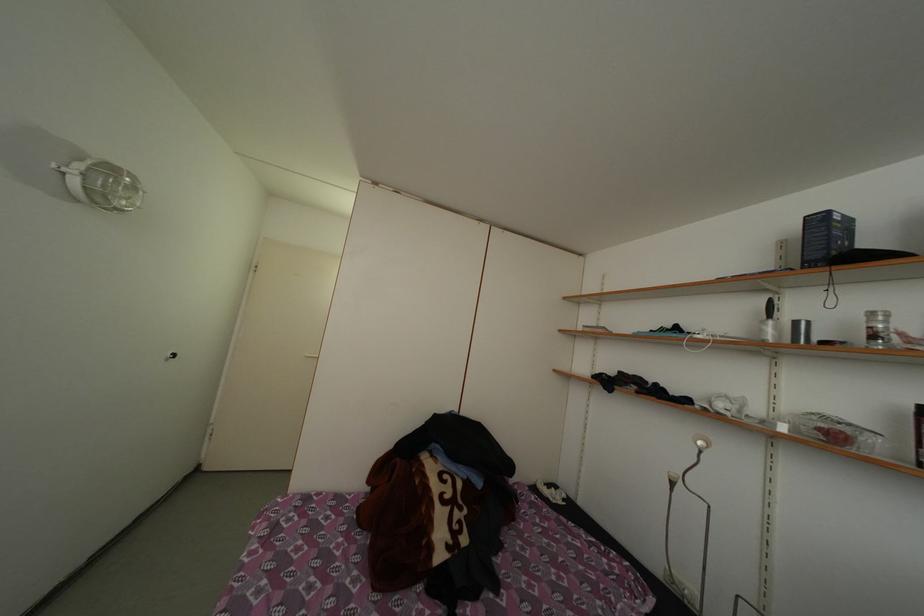
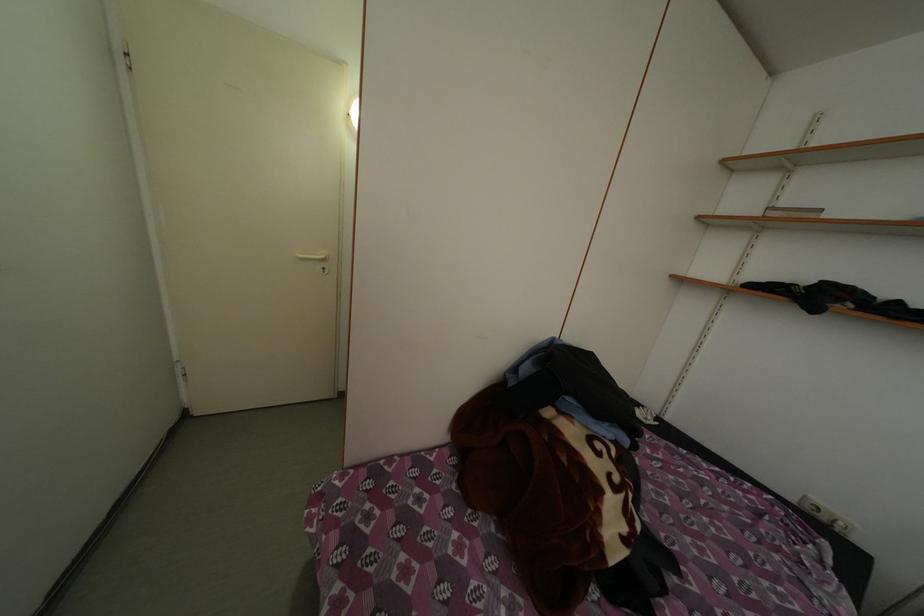
Which direction would the cameraman need to move to produce the second image?

The movement direction of the cameraman is left, forward.